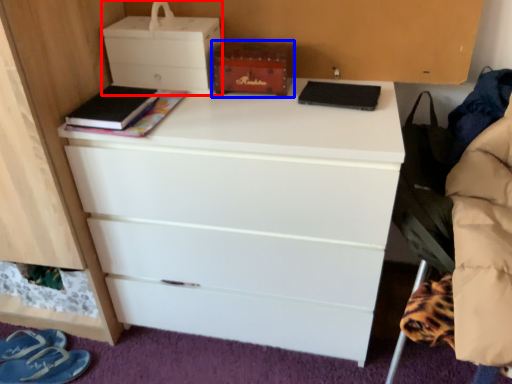
Question: Which of the following is the farthest to the observer, storage box (highlighted by a red box) or storage box (highlighted by a blue box)?

Choices:
 (A) storage box
 (B) storage box

Answer: (B)